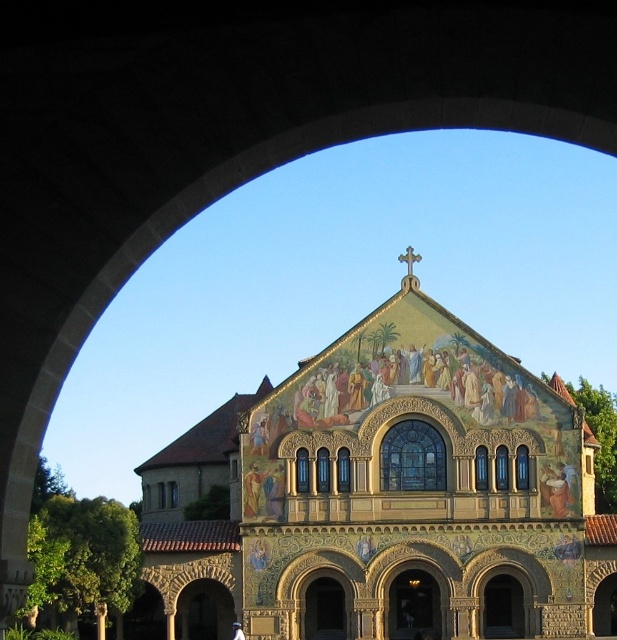
You are standing in front of a large arched opening leading to a grand building. There is a point marked at coordinates [386,496]. Based on the description, what does this point indicate?

The point at coordinates [386,496] marks the golden mosaic church at center.

You are standing in a courtyard and see the golden mosaic church at center and the white stone pillar at lower left. Which object is located to the left of the other?

The white stone pillar at lower left is located to the left of the golden mosaic church at center.